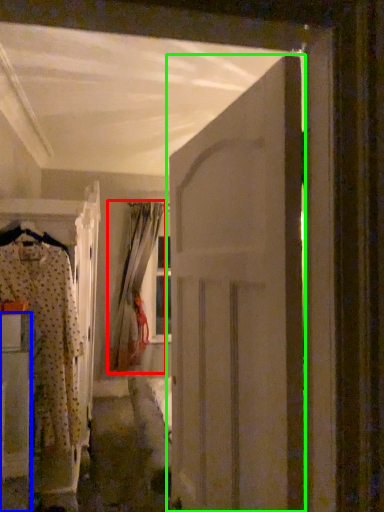
Question: Which object is positioned farthest from curtain (highlighted by a red box)? Select from furniture (highlighted by a blue box) and door (highlighted by a green box).

Choices:
 (A) furniture
 (B) door

Answer: (B)